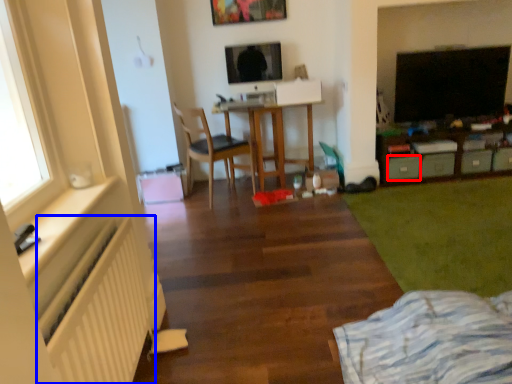
Question: Which object appears farthest to the camera in this image, drawer (highlighted by a red box) or radiator (highlighted by a blue box)?

Choices:
 (A) drawer
 (B) radiator

Answer: (A)